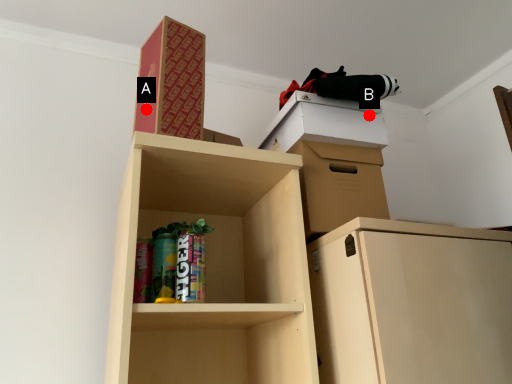
Question: Two points are circled on the image, labeled by A and B beside each circle. Which point is farther from the camera taking this photo?

Choices:
 (A) A is further
 (B) B is further

Answer: (B)